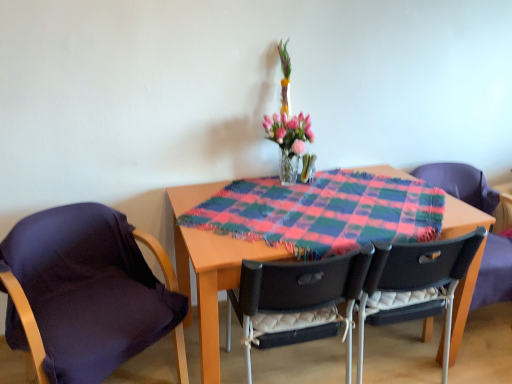
Question: From the image's perspective, is translucent glass vase at center above black plastic chair at center, marked as the 2th chair in a right-to-left arrangement?

Choices:
 (A) yes
 (B) no

Answer: (A)

Question: Would you say black plastic chair at center, marked as the 2th chair in a right-to-left arrangement, is part of translucent glass vase at center's contents?

Choices:
 (A) no
 (B) yes

Answer: (A)

Question: Could you tell me if translucent glass vase at center is turned towards black plastic chair at center, the 3th chair when ordered from left to right?

Choices:
 (A) no
 (B) yes

Answer: (A)

Question: From a real-world perspective, is translucent glass vase at center positioned over black plastic chair at center, marked as the 2th chair in a right-to-left arrangement, based on gravity?

Choices:
 (A) yes
 (B) no

Answer: (A)

Question: Considering the relative sizes of translucent glass vase at center and black plastic chair at center, marked as the 2th chair in a right-to-left arrangement, in the image provided, is translucent glass vase at center smaller than black plastic chair at center, marked as the 2th chair in a right-to-left arrangement,?

Choices:
 (A) yes
 (B) no

Answer: (A)

Question: Is translucent glass vase at center next to black plastic chair at center, the 3th chair when ordered from left to right?

Choices:
 (A) yes
 (B) no

Answer: (B)

Question: Is black plastic chair at center, which is the third chair in right-to-left order, aimed at dark purple fabric at left, the 4th chair positioned from the right?

Choices:
 (A) yes
 (B) no

Answer: (B)

Question: Is black plastic chair at center, which is the third chair in right-to-left order, smaller than dark purple fabric at left, acting as the 1th chair starting from the left?

Choices:
 (A) yes
 (B) no

Answer: (A)

Question: Is black plastic chair at center, which is the third chair in right-to-left order, outside dark purple fabric at left, the 4th chair positioned from the right?

Choices:
 (A) yes
 (B) no

Answer: (A)

Question: Can you confirm if black plastic chair at center, which appears as the second chair when viewed from the left, is thinner than dark purple fabric at left, the 4th chair positioned from the right?

Choices:
 (A) no
 (B) yes

Answer: (B)

Question: Is black plastic chair at center, which appears as the second chair when viewed from the left, shorter than dark purple fabric at left, acting as the 1th chair starting from the left?

Choices:
 (A) yes
 (B) no

Answer: (B)

Question: Does black plastic chair at center, which appears as the second chair when viewed from the left, have a greater width compared to dark purple fabric at left, acting as the 1th chair starting from the left?

Choices:
 (A) no
 (B) yes

Answer: (A)

Question: Is plaid fabric at center completely or partially outside of translucent glass vase at center?

Choices:
 (A) no
 (B) yes

Answer: (B)